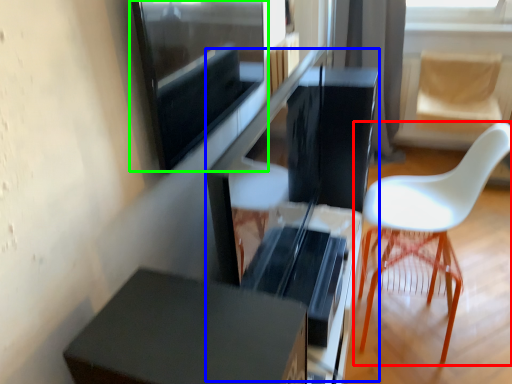
Question: Which object is the farthest from chair (highlighted by a red box)? Choose among these: computer desk (highlighted by a blue box) or window screen (highlighted by a green box).

Choices:
 (A) computer desk
 (B) window screen

Answer: (B)